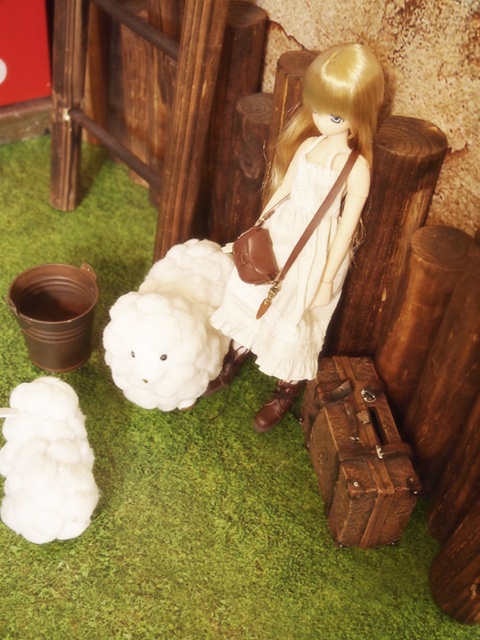
You are a tiny explorer in this miniature scene. You see the doll and the rustic leather suitcase at lower right. There is a point marked at coordinates (x=358, y=452). Where is this point located in relation to the rustic leather suitcase at lower right?

The point marked at coordinates (x=358, y=452) is located on the rustic leather suitcase at lower right.

You are a tiny explorer in this miniature scene. You see two points marked in the image. The first point is at coordinates point (x=377, y=397) and the second point is at point (x=10, y=426). If you are facing the scene, which point is closer to you?

Point (x=10, y=426) is closer to you because it is in front of point (x=377, y=397).

You are a child playing in this miniature scene. You want to place your favorite toy, which is the same size as the white fluffy toy at lower left, next to the white cotton dress at center. Will it fit comfortably without overlapping?

The white cotton dress at center is larger in size than the white fluffy toy at lower left. Since the toy is smaller, it should fit comfortably next to the dress without overlapping.